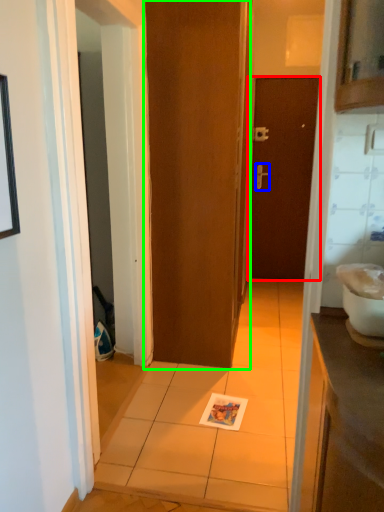
Question: Estimate the real-world distances between objects in this image. Which object is farther from door (highlighted by a red box), door handle (highlighted by a blue box) or door (highlighted by a green box)?

Choices:
 (A) door handle
 (B) door

Answer: (B)